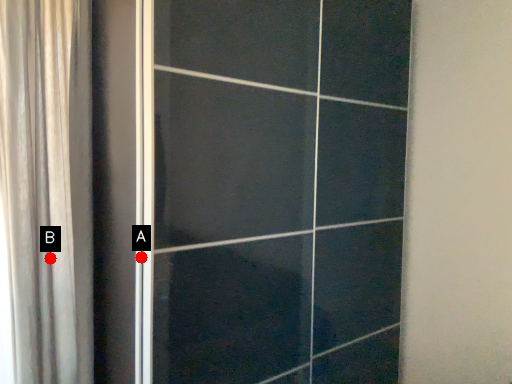
Question: Two points are circled on the image, labeled by A and B beside each circle. Which point appears farthest from the camera in this image?

Choices:
 (A) A is further
 (B) B is further

Answer: (B)